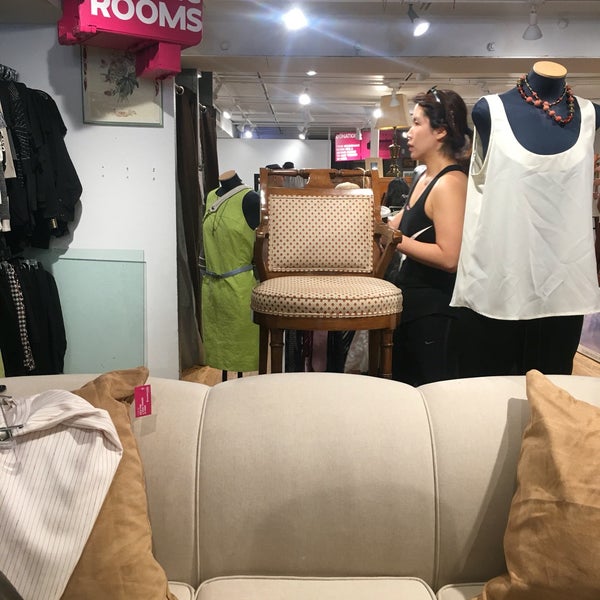
Find the location of a particular element. This screenshot has height=600, width=600. light blue wall is located at coordinates (98, 313).